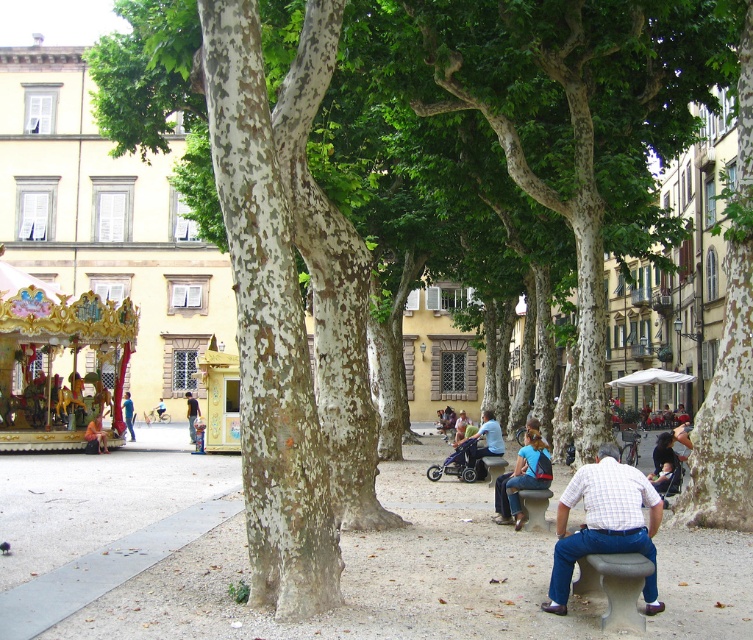
Looking at this image, you are a photographer standing in the park and want to capture a photo of the gray concrete bench at lower right and the blue jeans at center. Which object appears shorter in the photo?

The gray concrete bench at lower right appears shorter because it has a lesser height compared to the blue jeans at center.

Consider the image. You are standing in an urban park with a European architectural style. You see blue denim jeans at center. Where exactly are the blue denim jeans located in the scene?

The blue denim jeans at center are located at the 2D coordinates point [523,477] in the scene.